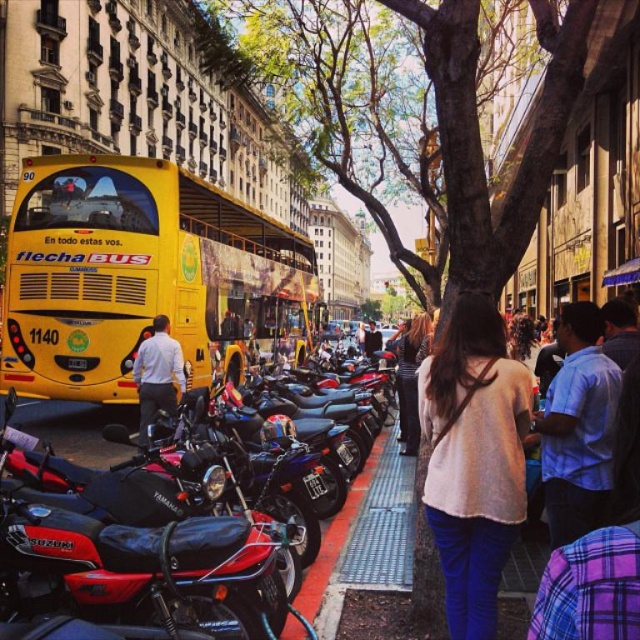
Question: From the image, what is the correct spatial relationship of yellow matte bus at center in relation to shiny black dress at center?

Choices:
 (A) above
 (B) below

Answer: (A)

Question: Does light beige sweater at center have a lesser width compared to blue plaid shirt at center right?

Choices:
 (A) no
 (B) yes

Answer: (B)

Question: Is yellow matte bus at center wider than white shirt at center?

Choices:
 (A) no
 (B) yes

Answer: (B)

Question: Which is nearer to the yellow matte bus at center?

Choices:
 (A) blue plaid shirt at center right
 (B) light beige sweater at center

Answer: (B)

Question: Which point is farther to the camera?

Choices:
 (A) [419, 426]
 (B) [499, 316]
 (C) [88, 346]

Answer: (A)

Question: Which point is closer to the camera?

Choices:
 (A) white shirt at center
 (B) yellow matte bus at center
 (C) light beige sweater at center
 (D) blue plaid shirt at center right

Answer: (D)